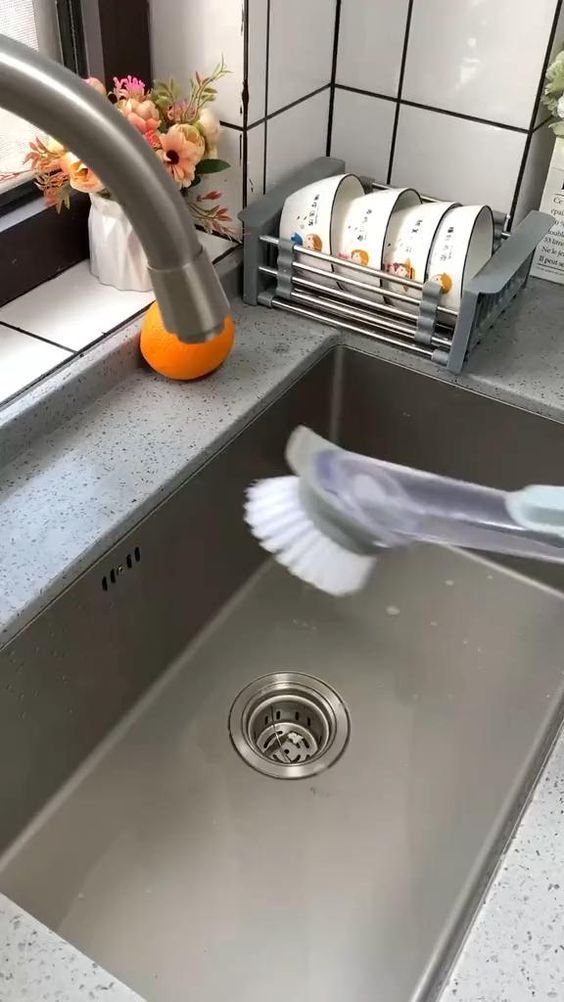
Where is `counter`? Image resolution: width=564 pixels, height=1002 pixels. counter is located at coordinates (506, 991), (61, 979), (83, 494), (505, 347).